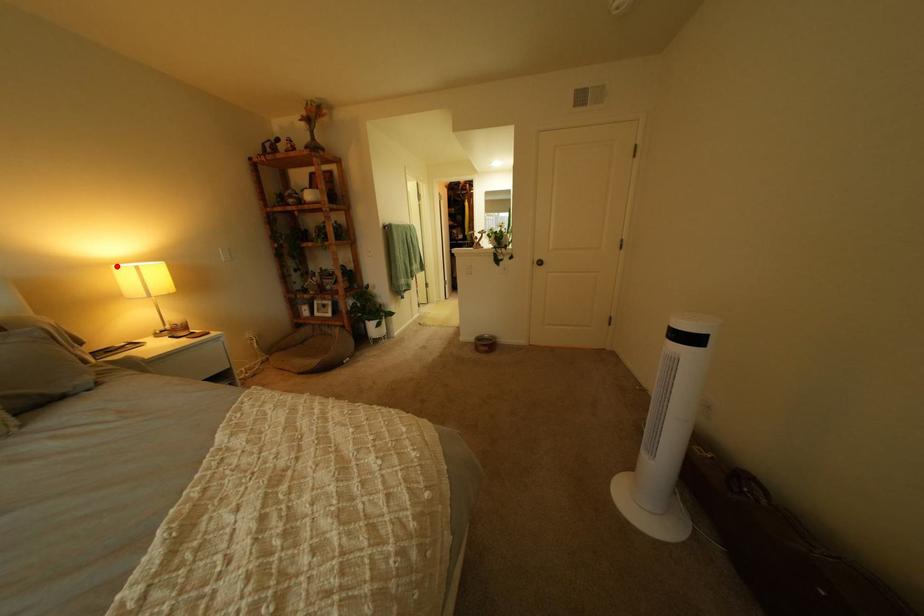
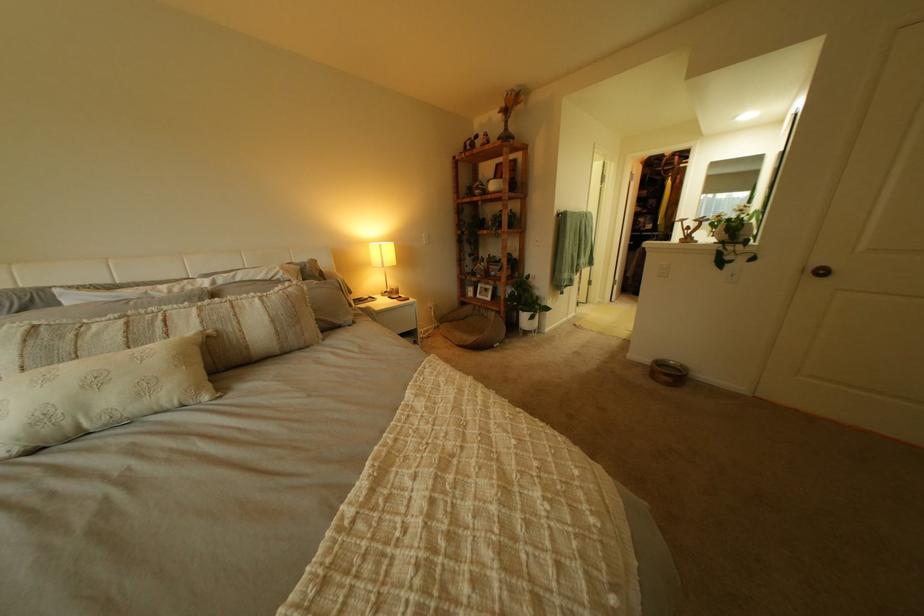
Question: I am providing you with two images of the same scene from different viewpoints. A red point is shown in image1. For the corresponding object point in image2, is it positioned nearer or farther from the camera?

Choices:
 (A) Nearer
 (B) Farther

Answer: (A)